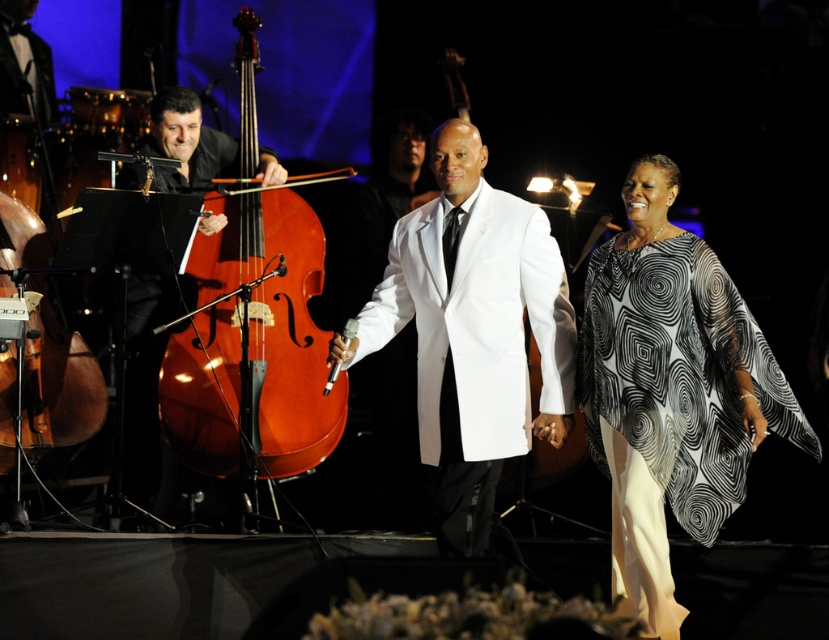
Question: Can you confirm if shiny varnished cello at left is positioned to the left of brown polished wood violin at left?

Choices:
 (A) yes
 (B) no

Answer: (B)

Question: In this image, where is white satin suit at center located relative to shiny brown cello at left?

Choices:
 (A) left
 (B) right

Answer: (B)

Question: Which of the following is the closest to the observer?

Choices:
 (A) (326, 436)
 (B) (66, 419)
 (C) (511, 305)

Answer: (C)

Question: Which of these objects is positioned closest to the white satin suit at center?

Choices:
 (A) black and white printed fabric at center
 (B) shiny brown cello at left
 (C) shiny varnished cello at left

Answer: (A)

Question: Which of these objects is positioned closest to the black and white printed fabric at center?

Choices:
 (A) shiny varnished cello at left
 (B) shiny brown cello at left

Answer: (A)

Question: Can you confirm if shiny brown cello at left is bigger than brown polished wood violin at left?

Choices:
 (A) no
 (B) yes

Answer: (A)